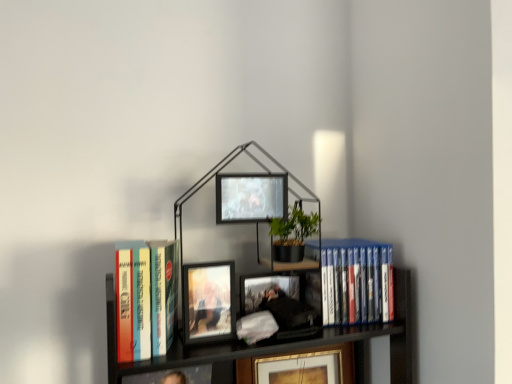
Question: From a real-world perspective, is hardcover books at left, positioned as the first book in left-to-right order, above or below metallic black bookcase at center?

Choices:
 (A) above
 (B) below

Answer: (B)

Question: Does point (144, 258) appear closer or farther from the camera than point (108, 364)?

Choices:
 (A) farther
 (B) closer

Answer: (B)

Question: Which of these objects is positioned farthest from the metallic black bookcase at center?

Choices:
 (A) matte black picture frame at center, the first picture frame from the bottom
 (B) matte black picture frame at center, which is the first picture frame in top-to-bottom order
 (C) matte wooden picture frame at center, marked as the second picture frame in a bottom-to-top arrangement
 (D) blue plastic dvds at right, the first book in the back-to-front sequence
 (E) hardcover books at left, positioned as the first book in left-to-right order

Answer: (A)

Question: Estimate the real-world distances between objects in this image. Which object is farther from the matte black picture frame at center, arranged as the third picture frame when viewed from the top?

Choices:
 (A) metallic black bookcase at center
 (B) blue plastic dvds at right, the first book in the back-to-front sequence
 (C) hardcover books at left, arranged as the 2th book when viewed from the right
 (D) matte black picture frame at center, marked as the 3th picture frame in a bottom-to-top arrangement
 (E) matte wooden picture frame at center, which appears as the first picture frame when viewed from the front

Answer: (D)